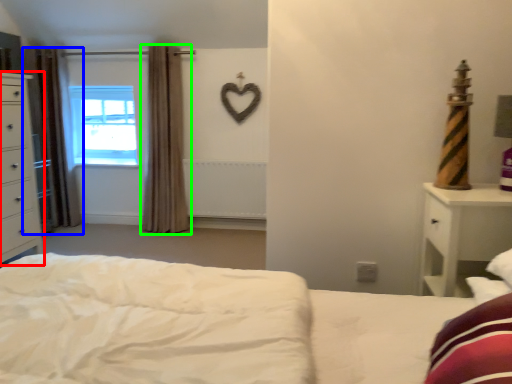
Question: Based on their relative distances, which object is farther from chest of drawers (highlighted by a red box)? Choose from curtain (highlighted by a blue box) and curtain (highlighted by a green box).

Choices:
 (A) curtain
 (B) curtain

Answer: (B)